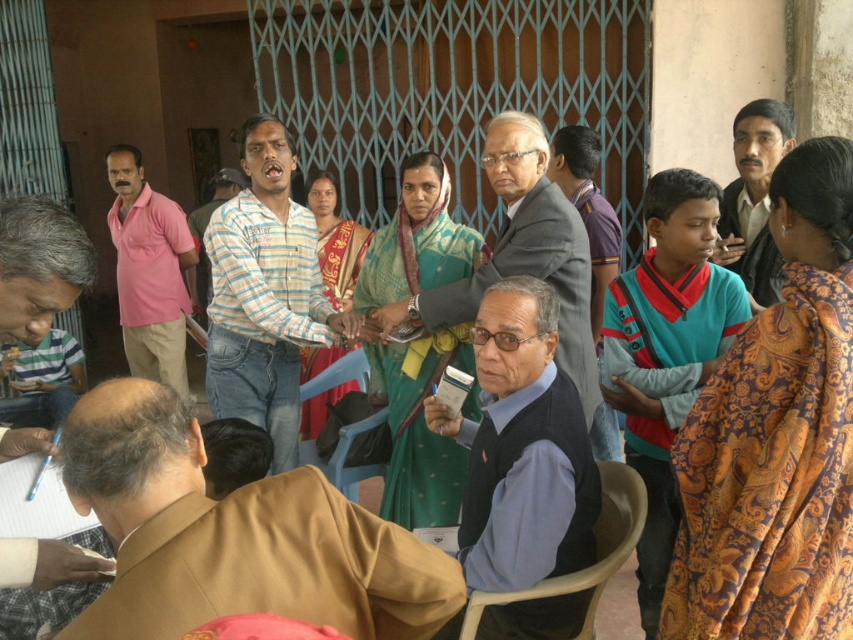
At what (x,y) coordinates should I click in order to perform the action: click on dark blue fabric vest at center. Please return your answer as a coordinate pair (x, y). Image resolution: width=853 pixels, height=640 pixels. Looking at the image, I should click on (521, 449).

Is dark blue fabric vest at center to the right of matte black shirt at upper right from the viewer's perspective?

No, dark blue fabric vest at center is not to the right of matte black shirt at upper right.

The height and width of the screenshot is (640, 853). Identify the location of dark blue fabric vest at center. (521, 449).

You are a GUI agent. You are given a task and a screenshot of the screen. Output one action in this format:
    pyautogui.click(x=<x>, y=<y>)
    Task: Click on the matte gray vest at center
    The width and height of the screenshot is (853, 640).
    Given the screenshot: What is the action you would take?
    pyautogui.click(x=526, y=262)

Can you confirm if striped cotton shirt at center is positioned to the right of matte gray vest at center?

No, striped cotton shirt at center is not to the right of matte gray vest at center.

Is striped cotton shirt at center to the left of matte gray vest at center from the viewer's perspective?

Indeed, striped cotton shirt at center is positioned on the left side of matte gray vest at center.

Between point (299, 317) and point (589, 342), which one is positioned behind?

The point (299, 317) is behind.

The image size is (853, 640). Identify the location of striped cotton shirt at center. pyautogui.click(x=265, y=294).